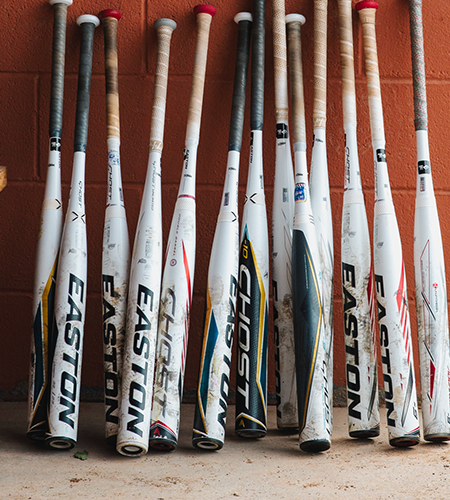
At what (x,y) coordinates should I click in order to perform the action: click on grey handle. Please return your answer as a coordinate pair (x, y). The image size is (450, 500). Looking at the image, I should click on (169, 23).